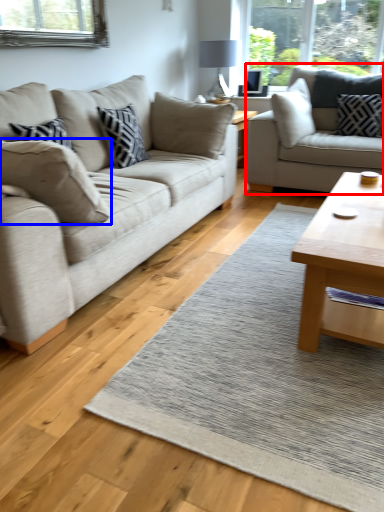
Question: Which of the following is the farthest to the observer, studio couch (highlighted by a red box) or pillow (highlighted by a blue box)?

Choices:
 (A) studio couch
 (B) pillow

Answer: (A)